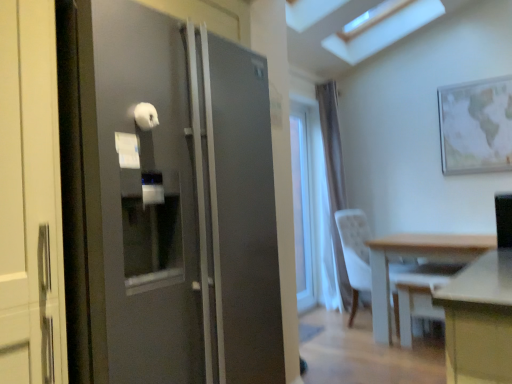
Locate an element on the screen. This screenshot has width=512, height=384. white sheer curtain at center is located at coordinates (334, 180).

The width and height of the screenshot is (512, 384). Describe the element at coordinates (415, 257) in the screenshot. I see `light wood table at lower right` at that location.

Where is `clear glass window at center`? The width and height of the screenshot is (512, 384). clear glass window at center is located at coordinates (303, 209).

You are a GUI agent. You are given a task and a screenshot of the screen. Output one action in this format:
    pyautogui.click(x=<x>, y=<y>)
    Task: Click on the satin black refrigerator at left
    The image size is (512, 384).
    Given the screenshot: What is the action you would take?
    pyautogui.click(x=177, y=202)

From the image's perspective, which object appears higher, matte wooden map at upper right or white sheer curtain at center?

matte wooden map at upper right.

Is matte wooden map at upper right taller or shorter than white sheer curtain at center?

Considering their sizes, matte wooden map at upper right has less height than white sheer curtain at center.

The image size is (512, 384). I want to click on picture frame in front of the white sheer curtain at center, so click(x=476, y=126).

Would you say matte wooden map at upper right is outside white sheer curtain at center?

Absolutely, matte wooden map at upper right is external to white sheer curtain at center.

Can you confirm if satin black refrigerator at left is positioned to the left of white fabric chair at right?

Yes.

From a real-world perspective, relative to white fabric chair at right, is satin black refrigerator at left vertically above or below?

satin black refrigerator at left is above white fabric chair at right.

Locate an element on the screen. chair behind the satin black refrigerator at left is located at coordinates (355, 252).

Is satin black refrigerator at left closer to the viewer compared to white fabric chair at right?

Yes, it is.

Can you confirm if white fabric chair at right is positioned to the left of satin black refrigerator at left?

No.

Choose the correct answer: Is white fabric chair at right inside satin black refrigerator at left or outside it?

white fabric chair at right is located beyond the bounds of satin black refrigerator at left.

Which of these two, white fabric chair at right or white plastic swivel chair at lower right, stands shorter?

Standing shorter between the two is white plastic swivel chair at lower right.

Is white fabric chair at right positioned beyond the bounds of white plastic swivel chair at lower right?

Indeed, white fabric chair at right is completely outside white plastic swivel chair at lower right.

Measure the distance between white fabric chair at right and white plastic swivel chair at lower right.

white fabric chair at right and white plastic swivel chair at lower right are 11.00 inches apart from each other.

Is the depth of white fabric chair at right greater than that of white plastic swivel chair at lower right?

Yes, it is.

Locate an element on the screen. window above the satin black refrigerator at left (from a real-world perspective) is located at coordinates (303, 209).

Is satin black refrigerator at left next to clear glass window at center?

satin black refrigerator at left is not next to clear glass window at center, and they're not touching.

Considering the relative sizes of satin black refrigerator at left and clear glass window at center in the image provided, is satin black refrigerator at left taller than clear glass window at center?

No.

Identify the location of picture frame located behind the white plastic swivel chair at lower right. Image resolution: width=512 pixels, height=384 pixels. (476, 126).

Considering the relative sizes of white plastic swivel chair at lower right and matte wooden map at upper right in the image provided, is white plastic swivel chair at lower right smaller than matte wooden map at upper right?

Actually, white plastic swivel chair at lower right might be larger than matte wooden map at upper right.

Is the surface of white plastic swivel chair at lower right in direct contact with matte wooden map at upper right?

No, white plastic swivel chair at lower right is not with matte wooden map at upper right.

Considering the relative sizes of white plastic swivel chair at lower right and matte wooden map at upper right in the image provided, is white plastic swivel chair at lower right thinner than matte wooden map at upper right?

Incorrect, the width of white plastic swivel chair at lower right is not less than that of matte wooden map at upper right.

Could you tell me if clear glass window at center is facing light wood table at lower right?

Yes.

Identify the location of window located on the left of light wood table at lower right. (303, 209).

Considering the points (303, 253) and (376, 307), which point is in front, point (303, 253) or point (376, 307)?

The point (376, 307) is in front.

Does clear glass window at center touch light wood table at lower right?

No, clear glass window at center is not touching light wood table at lower right.

Image resolution: width=512 pixels, height=384 pixels. What are the coordinates of `curtain to the left of matte wooden map at upper right` in the screenshot? It's located at (334, 180).

This screenshot has height=384, width=512. What are the coordinates of `chair behind the satin black refrigerator at left` in the screenshot? It's located at (355, 252).

Based on their spatial positions, is light wood table at lower right or matte wooden map at upper right closer to clear glass window at center?

Among the two, light wood table at lower right is located nearer to clear glass window at center.

Considering their positions, is matte wooden map at upper right positioned further to light wood table at lower right than white plastic swivel chair at lower right?

Among the two, matte wooden map at upper right is located further to light wood table at lower right.

Which object lies nearer to the anchor point matte wooden map at upper right, light wood table at lower right or white fabric chair at right?

light wood table at lower right is positioned closer to the anchor matte wooden map at upper right.

From the image, which object appears to be nearer to white plastic swivel chair at lower right, clear glass window at center or light wood table at lower right?

The object closer to white plastic swivel chair at lower right is light wood table at lower right.

Estimate the real-world distances between objects in this image. Which object is further from white sheer curtain at center, matte wooden map at upper right or clear glass window at center?

Based on the image, matte wooden map at upper right appears to be further to white sheer curtain at center.

When comparing their distances from matte wooden map at upper right, does white fabric chair at right or light wood table at lower right seem further?

The object further to matte wooden map at upper right is white fabric chair at right.

From the image, which object appears to be farther from light wood table at lower right, white sheer curtain at center or satin black refrigerator at left?

satin black refrigerator at left lies further to light wood table at lower right than the other object.

From the image, which object appears to be farther from white plastic swivel chair at lower right, matte wooden map at upper right or white sheer curtain at center?

matte wooden map at upper right lies further to white plastic swivel chair at lower right than the other object.

This screenshot has height=384, width=512. I want to click on table between satin black refrigerator at left and white sheer curtain at center from front to back, so tap(415, 257).

In order to click on picture frame located between satin black refrigerator at left and clear glass window at center in the depth direction in this screenshot , I will do `click(476, 126)`.

Where is `window located between white plastic swivel chair at lower right and white sheer curtain at center in the depth direction`? window located between white plastic swivel chair at lower right and white sheer curtain at center in the depth direction is located at coordinates (303, 209).

The height and width of the screenshot is (384, 512). I want to click on chair between satin black refrigerator at left and clear glass window at center along the z-axis, so point(355,252).